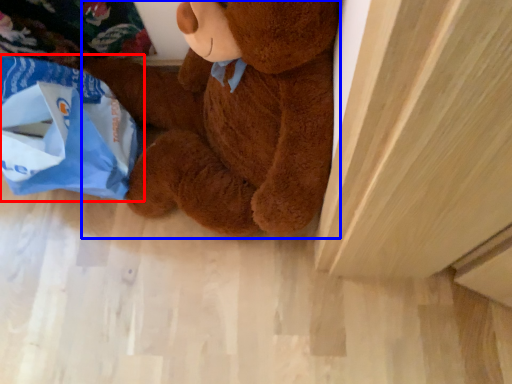
Question: Which object is further to the camera taking this photo, grocery bag (highlighted by a red box) or teddy bear (highlighted by a blue box)?

Choices:
 (A) grocery bag
 (B) teddy bear

Answer: (A)